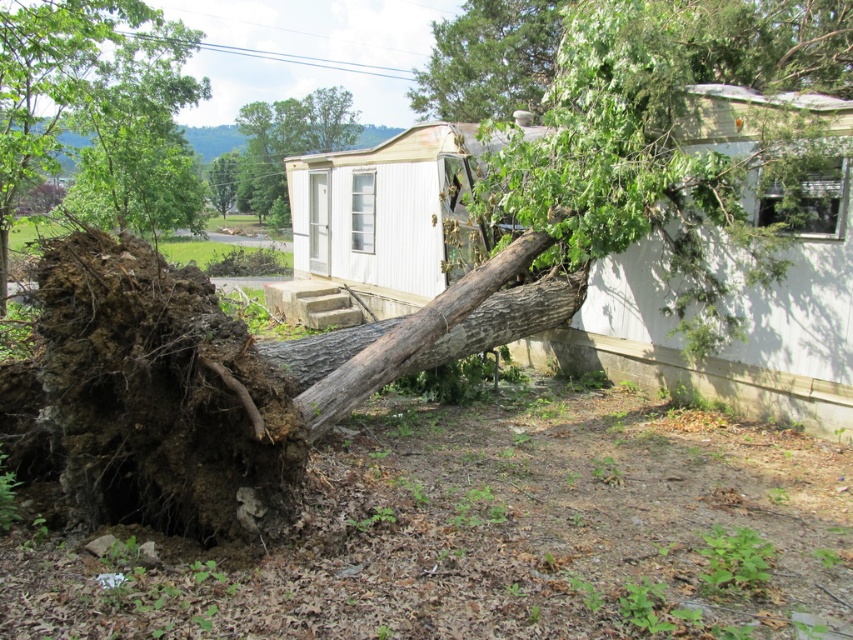
Who is lower down, brown rough wood at center or brown rough bark tree at left?

brown rough wood at center

Between brown rough wood at center and brown rough bark tree at left, which one is positioned higher?

Positioned higher is brown rough bark tree at left.

The image size is (853, 640). What do you see at coordinates (427, 332) in the screenshot? I see `brown rough wood at center` at bounding box center [427, 332].

Find the location of a particular element. This screenshot has height=640, width=853. brown rough wood at center is located at coordinates (427, 332).

Find the location of `brown rough bark tree at left`. brown rough bark tree at left is located at coordinates (51, 83).

Consider the image. Between brown rough bark tree at left and green rough bark tree at upper center, which one has less height?

brown rough bark tree at left is shorter.

Identify the location of brown rough bark tree at left. (51, 83).

You are a GUI agent. You are given a task and a screenshot of the screen. Output one action in this format:
    pyautogui.click(x=<x>, y=<y>)
    Task: Click on the brown rough bark tree at left
    The image size is (853, 640).
    Given the screenshot: What is the action you would take?
    pyautogui.click(x=51, y=83)

Is brown rough wood at center to the right of green rough bark tree at upper center from the viewer's perspective?

Incorrect, brown rough wood at center is not on the right side of green rough bark tree at upper center.

The image size is (853, 640). What do you see at coordinates (427, 332) in the screenshot?
I see `brown rough wood at center` at bounding box center [427, 332].

This screenshot has height=640, width=853. I want to click on brown rough wood at center, so click(x=427, y=332).